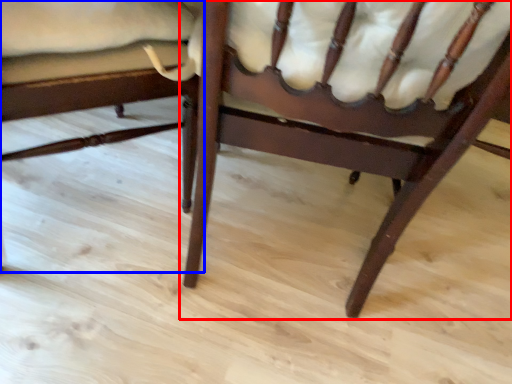
Question: Which object appears closest to the camera in this image, chair (highlighted by a red box) or chair (highlighted by a blue box)?

Choices:
 (A) chair
 (B) chair

Answer: (A)